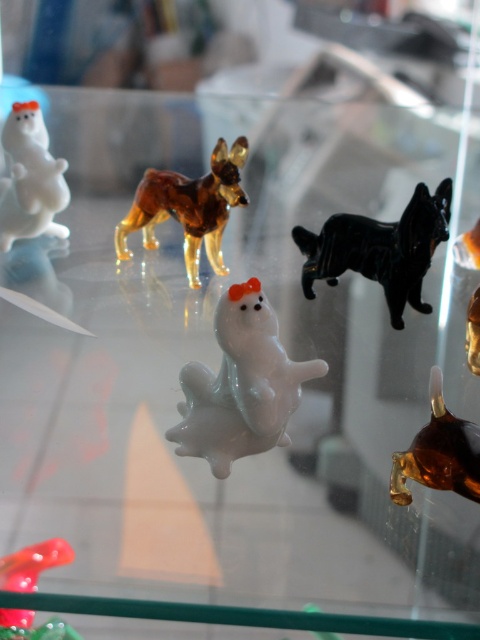
Question: Considering the real-world distances, which object is closest to the amber glass dog at upper center?

Choices:
 (A) white glossy bear at upper left
 (B) black glossy dog at center

Answer: (A)

Question: Considering the real-world distances, which object is closest to the amber glass dog at right?

Choices:
 (A) translucent red figurine at lower left
 (B) amber glass dog at upper center

Answer: (A)

Question: Estimate the real-world distances between objects in this image. Which object is closer to the black glossy dog at center?

Choices:
 (A) white glossy dog at center
 (B) amber glass dog at upper center
 (C) amber glass dog at right

Answer: (B)

Question: Does white glossy dog at center have a larger size compared to white glossy bear at upper left?

Choices:
 (A) yes
 (B) no

Answer: (B)

Question: Does black glossy dog at center appear on the left side of white glossy bear at upper left?

Choices:
 (A) no
 (B) yes

Answer: (A)

Question: Is black glossy dog at center smaller than amber glass dog at right?

Choices:
 (A) no
 (B) yes

Answer: (A)